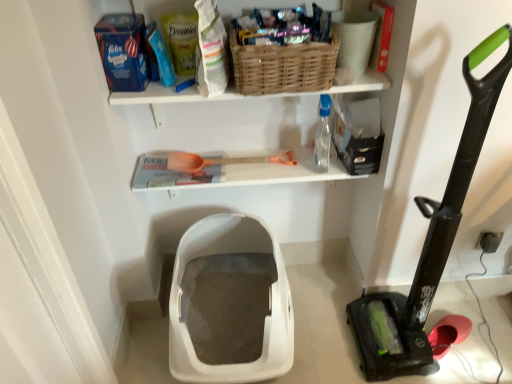
Where is `free space above woven brown basket at upper center (from a real-world perspective)`? free space above woven brown basket at upper center (from a real-world perspective) is located at coordinates (282, 27).